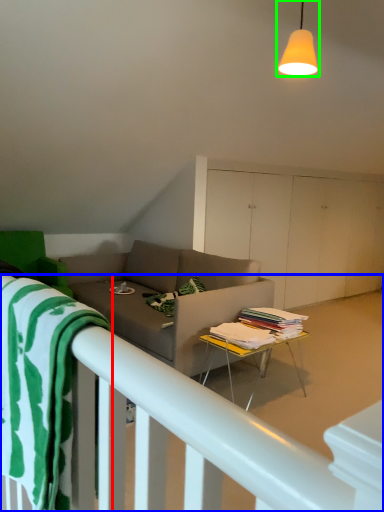
Question: Which object is positioned farthest from beach towel (highlighted by a red box)? Select from bed frame (highlighted by a blue box) and light fixture (highlighted by a green box).

Choices:
 (A) bed frame
 (B) light fixture

Answer: (B)